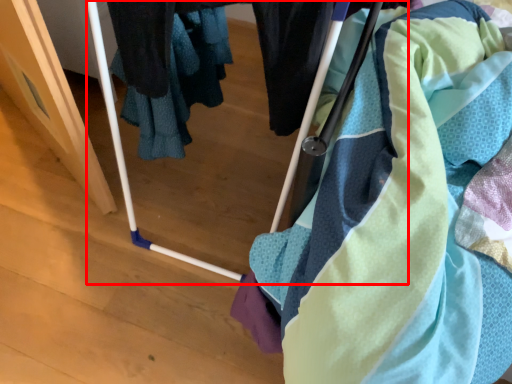
Question: From the image's perspective, where is baby carriage (annotated by the red box) located relative to towel?

Choices:
 (A) below
 (B) above

Answer: (B)